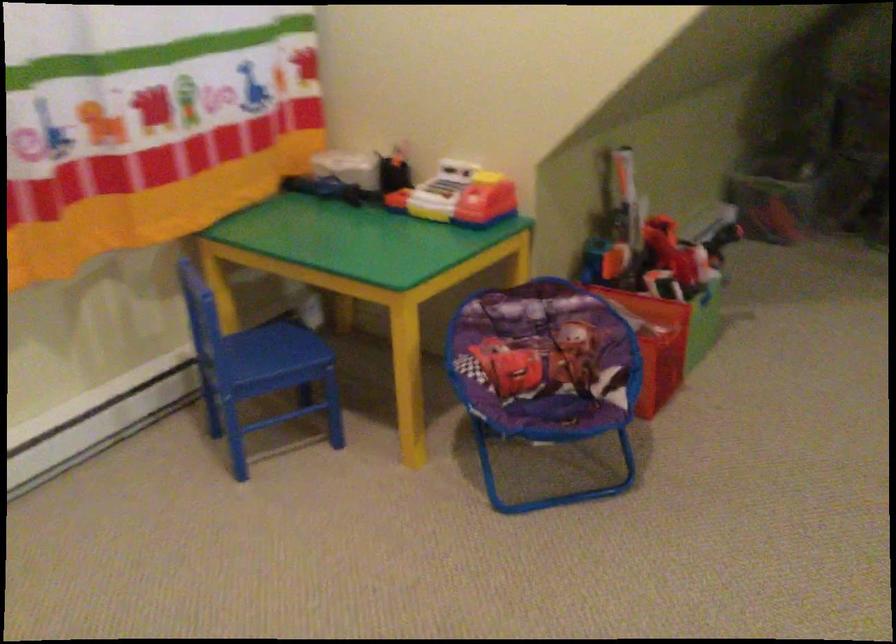
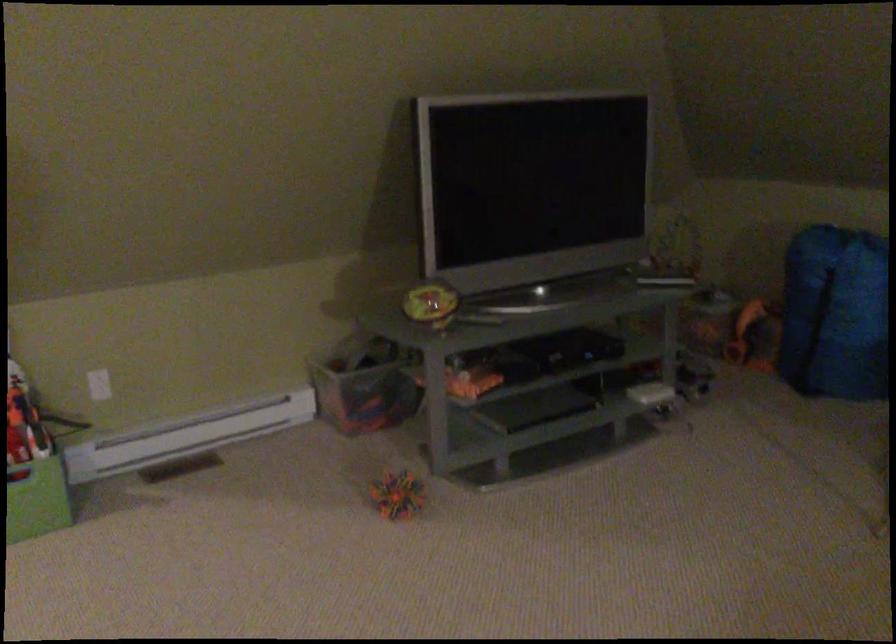
Question: The images are taken continuously from a first-person perspective. In which direction are you moving?

Choices:
 (A) Left
 (B) Right
 (C) Forward
 (D) Backward

Answer: (B)